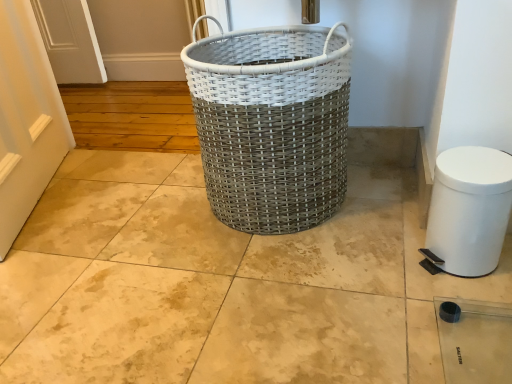
The width and height of the screenshot is (512, 384). Identify the location of free space in front of white woven basket at center. (283, 292).